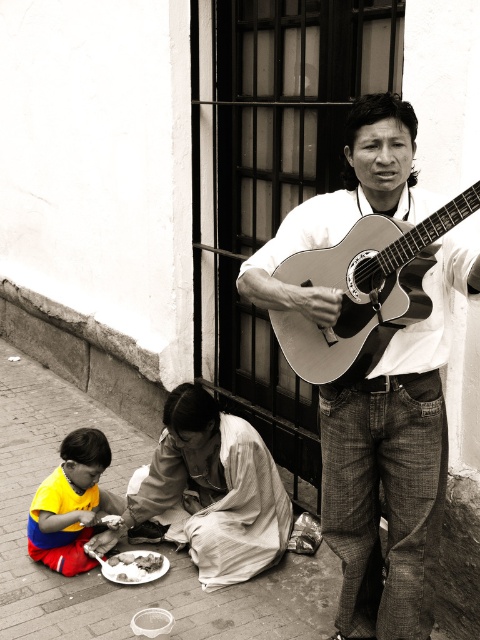
Who is higher up, brick pavement at lower left or white crumbly bread at lower left?

Positioned higher is brick pavement at lower left.

In the scene shown: Who is positioned more to the right, brick pavement at lower left or white crumbly bread at lower left?

white crumbly bread at lower left

Is point (192, 598) closer to camera compared to point (113, 572)?

Yes, point (192, 598) is in front of point (113, 572).

Locate an element on the screen. The image size is (480, 640). brick pavement at lower left is located at coordinates coord(40,477).

Can you confirm if wooden acoustic guitar at center is wider than white crumbly bread at lower left?

Result: Yes.

Is point (348, 352) in front of point (112, 573)?

That is True.

The image size is (480, 640). In order to click on wooden acoustic guitar at center in this screenshot , I will do `click(363, 291)`.

How much distance is there between smooth wood guitar at center and brick pavement at lower left?

They are 1.46 meters apart.

Is smooth wood guitar at center below brick pavement at lower left?

Incorrect, smooth wood guitar at center is not positioned below brick pavement at lower left.

Does point (331, 438) come closer to viewer compared to point (92, 369)?

Yes, point (331, 438) is in front of point (92, 369).

Where is `smooth wood guitar at center`? The height and width of the screenshot is (640, 480). smooth wood guitar at center is located at coordinates (393, 465).